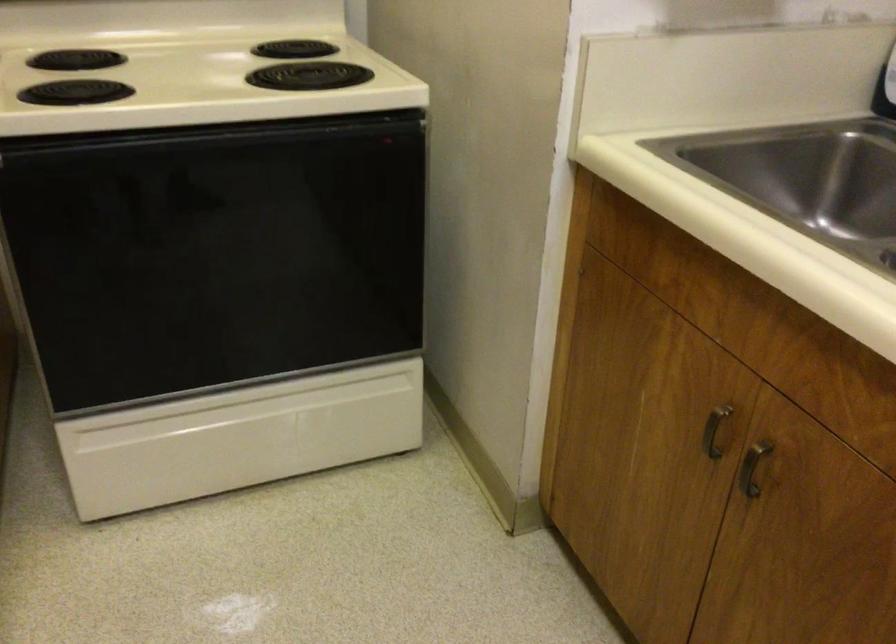
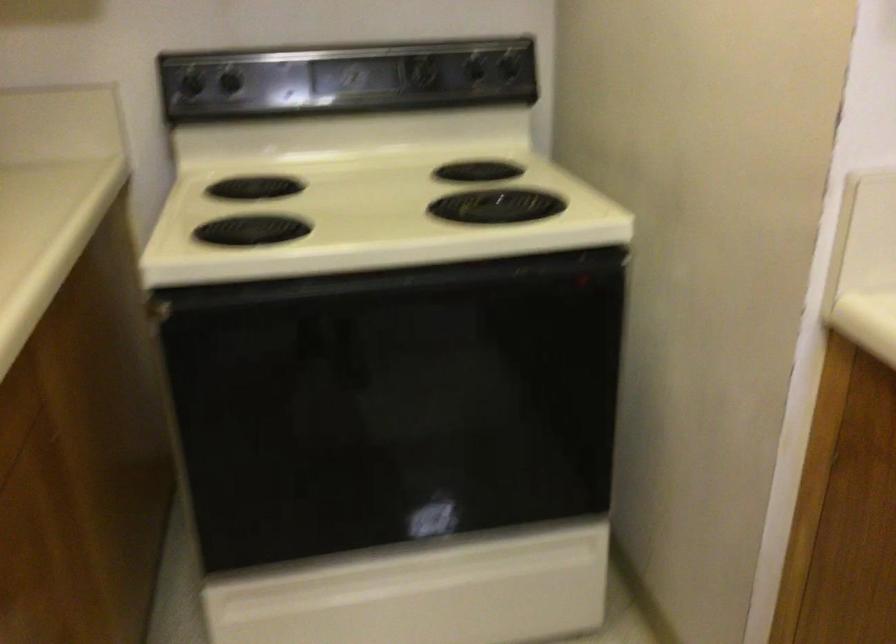
Question: The camera is either moving clockwise (left) or counter-clockwise (right) around the object. The first image is from the beginning of the video and the second image is from the end. Is the camera moving left or right when shooting the video?

Choices:
 (A) Left
 (B) Right

Answer: (B)